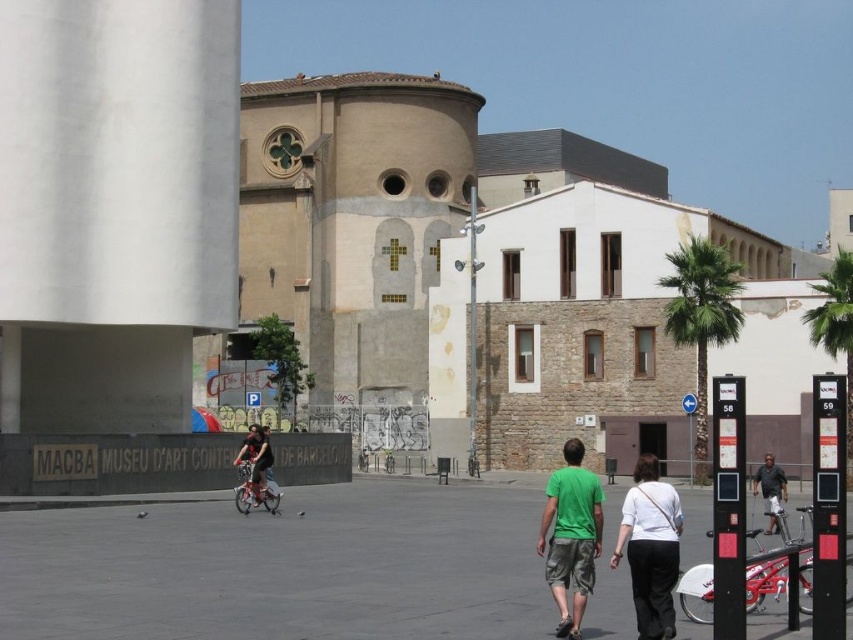
Who is positioned more to the left, matte black bicycle at center or dark gray shirt at center?

From the viewer's perspective, matte black bicycle at center appears more on the left side.

The width and height of the screenshot is (853, 640). I want to click on matte black bicycle at center, so click(256, 460).

Does white cotton shirt at center have a greater width compared to matte black bicycle at center?

No, white cotton shirt at center is not wider than matte black bicycle at center.

From the picture: How distant is white cotton shirt at center from matte black bicycle at center?

white cotton shirt at center and matte black bicycle at center are 24.88 meters apart.

Describe the element at coordinates (650, 548) in the screenshot. The image size is (853, 640). I see `white cotton shirt at center` at that location.

Identify the location of white cotton shirt at center. The width and height of the screenshot is (853, 640). (650, 548).

Does point (654, 522) lie behind point (782, 483)?

No.

Is point (666, 589) positioned after point (759, 474)?

No, (666, 589) is in front of (759, 474).

Locate an element on the screen. The image size is (853, 640). white cotton shirt at center is located at coordinates (650, 548).